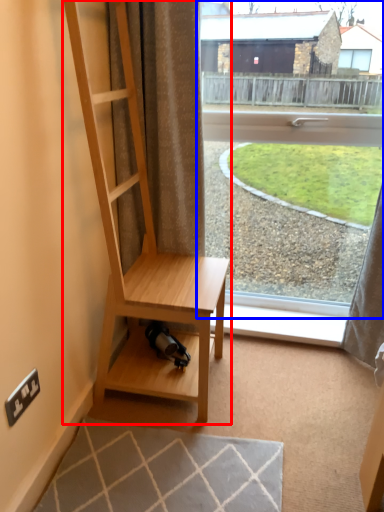
Question: Which object appears closest to the camera in this image, shelf (highlighted by a red box) or window (highlighted by a blue box)?

Choices:
 (A) shelf
 (B) window

Answer: (A)